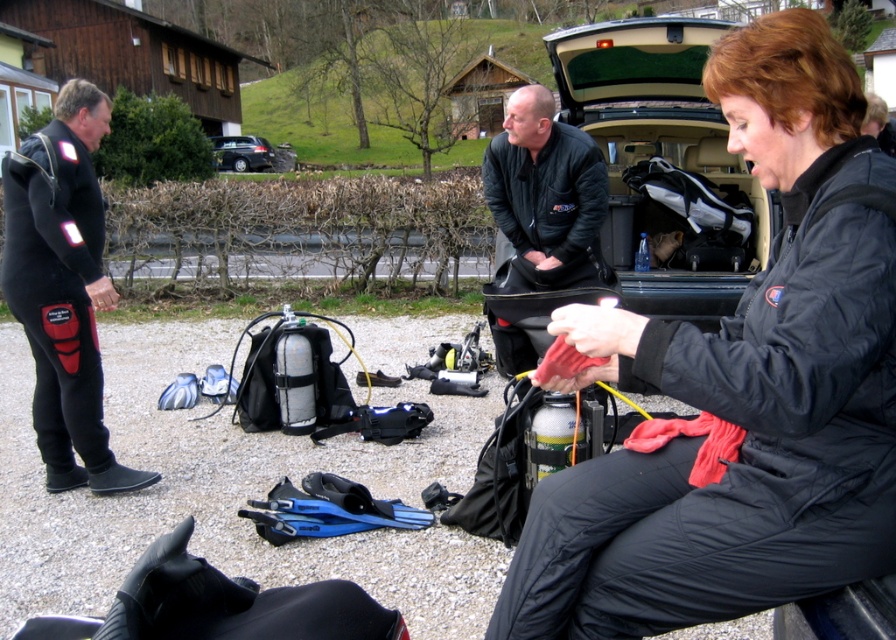
From the picture: You are a photographer trying to capture a wide shot of the scene. Given that the matte black jacket at center is smaller than the dark gray metallic car at center, which object should you focus on to ensure both are in frame without cropping?

Since the matte black jacket at center is smaller than the dark gray metallic car at center, you should focus on the dark gray metallic car at center as the primary subject. This will allow the smaller matte black jacket at center to remain in the frame without needing to crop either object.

You are standing in the scene and want to pick up the black rubber glove at lower left. Based on the coordinates provided, is it closer to the edge of the image or the center?

The black rubber glove at lower left is located at point (220,605). Since the coordinates are close to 1 on the x and y axes, it is closer to the edge of the image rather than the center.

You are a photographer at the scene. You need to capture a photo where both the matte black jacket at center and the black matte jacket at center are clearly visible. Which jacket should you focus on first to ensure both are in focus?

The matte black jacket at center is located below the black matte jacket at center, so focusing on the black matte jacket at center first will help ensure both are in focus as it is farther away.